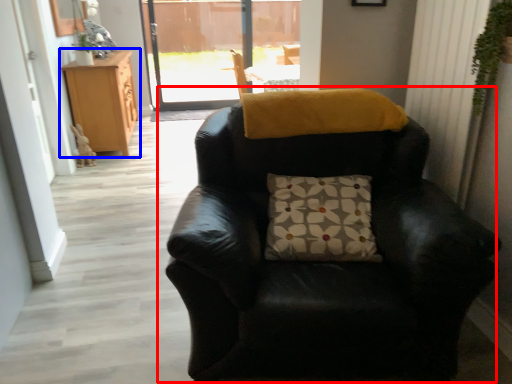
Question: Among these objects, which one is farthest to the camera, chair (highlighted by a red box) or cabinetry (highlighted by a blue box)?

Choices:
 (A) chair
 (B) cabinetry

Answer: (B)